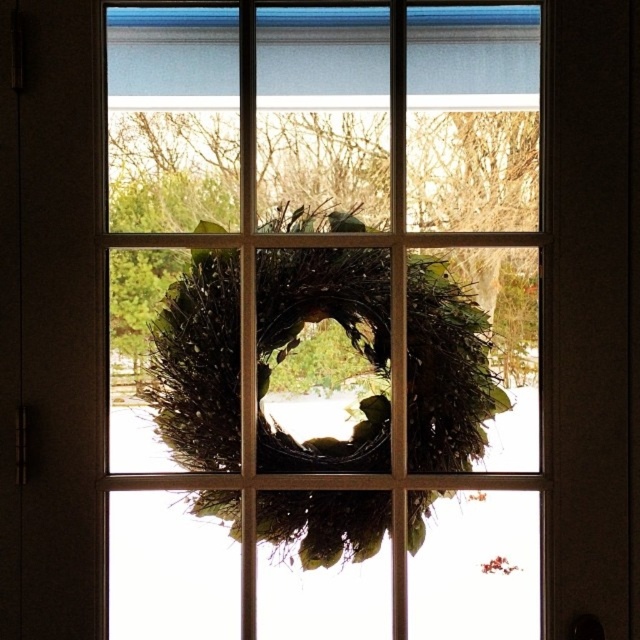
Does green twig wreath at center lie in front of green textured wreath at center?

That is True.

Can you confirm if green twig wreath at center is smaller than green textured wreath at center?

No, green twig wreath at center is not smaller than green textured wreath at center.

Is point (396, 513) farther from camera compared to point (205, 324)?

That is False.

Locate an element on the screen. green twig wreath at center is located at coordinates (323, 321).